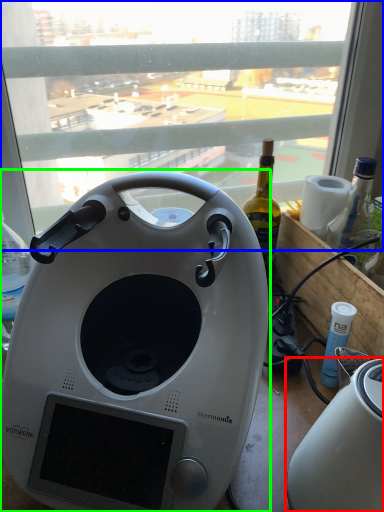
Question: Based on their relative distances, which object is nearer to toaster (highlighted by a red box)? Choose from window (highlighted by a blue box) and home appliance (highlighted by a green box).

Choices:
 (A) window
 (B) home appliance

Answer: (B)